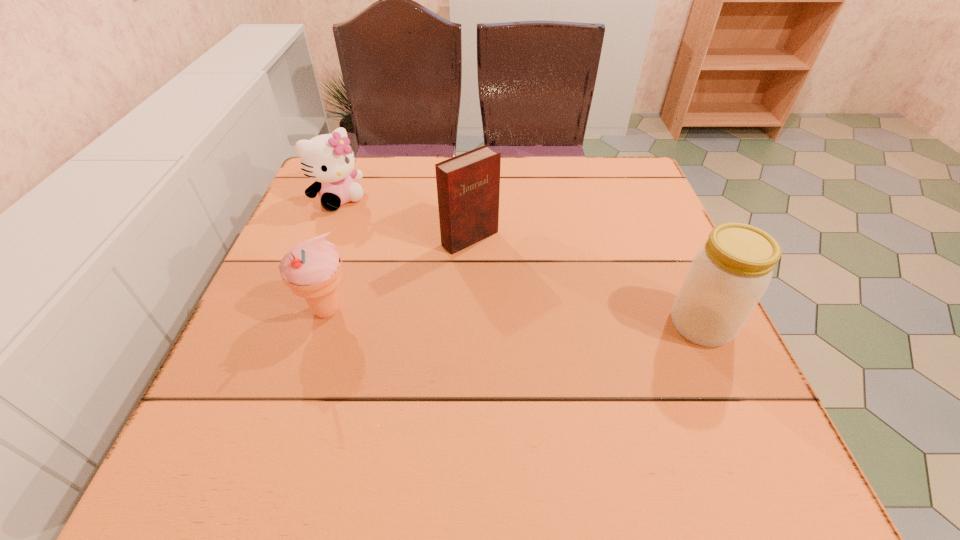
Where is `vacant space located on the front cover of the second farthest object`? vacant space located on the front cover of the second farthest object is located at coordinates coord(588,337).

This screenshot has height=540, width=960. I want to click on vacant point located 0.250m on the front cover of the second farthest object, so click(x=567, y=320).

Image resolution: width=960 pixels, height=540 pixels. What are the coordinates of `free space located 0.230m on the front cover of the second farthest object` in the screenshot? It's located at (561, 314).

This screenshot has height=540, width=960. Find the location of `object that is at the far edge`. object that is at the far edge is located at coordinates (328, 159).

Identify the location of icecream that is at the left edge. The width and height of the screenshot is (960, 540). (312, 269).

At what (x,y) coordinates should I click in order to perform the action: click on kitten positioned at the left edge. Please return your answer as a coordinate pair (x, y). The width and height of the screenshot is (960, 540). Looking at the image, I should click on (328, 159).

Find the location of a particular element. object at the right edge is located at coordinates tap(729, 274).

This screenshot has height=540, width=960. In order to click on object that is at the far left corner in this screenshot , I will do `click(328, 159)`.

In the image, there is a desktop. At what (x,y) coordinates should I click in order to perform the action: click on vacant space at the far edge. Please return your answer as a coordinate pair (x, y). This screenshot has height=540, width=960. Looking at the image, I should click on (540, 193).

Locate an element on the screen. This screenshot has height=540, width=960. free space at the left edge of the desktop is located at coordinates (297, 232).